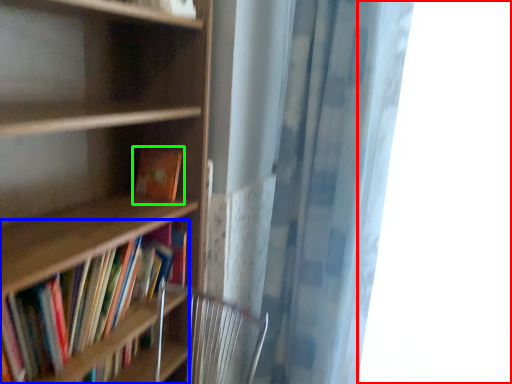
Question: Which is farther away from window (highlighted by a red box)? book (highlighted by a blue box) or book (highlighted by a green box)?

Choices:
 (A) book
 (B) book

Answer: (A)